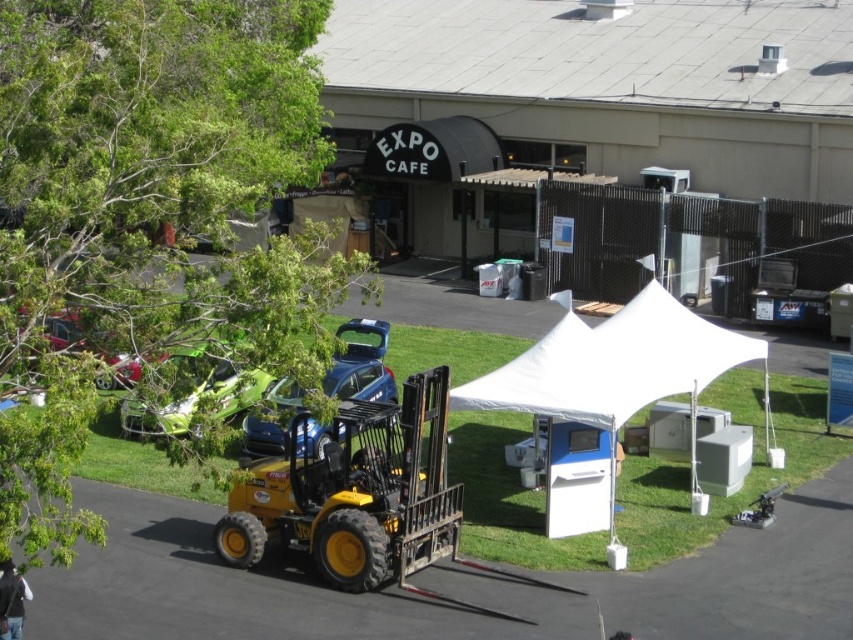
Question: Does yellow metallic forklift at center have a larger size compared to blue matte car at center?

Choices:
 (A) no
 (B) yes

Answer: (A)

Question: Observing the image, what is the correct spatial positioning of white fabric tent at center in reference to metallic red car at upper left?

Choices:
 (A) left
 (B) right

Answer: (B)

Question: Which point is closer to the camera?

Choices:
 (A) metallic red car at upper left
 (B) white fabric tent at center

Answer: (A)

Question: Among these objects, which one is nearest to the camera?

Choices:
 (A) blue matte car at center
 (B) white fabric tent at center

Answer: (A)

Question: Which of the following is the farthest from the observer?

Choices:
 (A) green matte car at lower left
 (B) blue matte car at center
 (C) yellow metallic forklift at center

Answer: (C)

Question: Considering the relative positions of white fabric tent at center and blue matte car at center in the image provided, where is white fabric tent at center located with respect to blue matte car at center?

Choices:
 (A) left
 (B) right

Answer: (B)